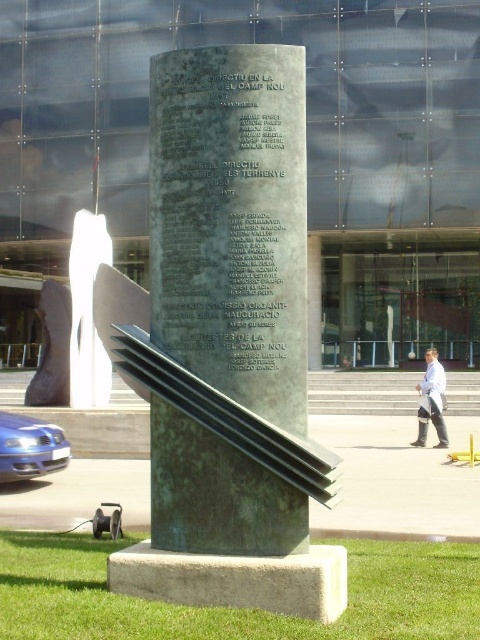
Question: Which point is farther from the camera taking this photo?

Choices:
 (A) (26, 456)
 (B) (441, 381)
 (C) (46, 307)

Answer: (B)

Question: Which of the following is the farthest from the observer?

Choices:
 (A) 443,432
 (B) 50,387
 (C) 11,470

Answer: (A)

Question: Does green patina stone monument at center appear on the right side of white lab coat at center?

Choices:
 (A) yes
 (B) no

Answer: (B)

Question: Does green patina stone monument at center appear on the left side of matte bronze statue at center?

Choices:
 (A) yes
 (B) no

Answer: (B)

Question: Based on their relative distances, which object is farther from the white lab coat at center?

Choices:
 (A) matte bronze statue at center
 (B) blue metallic car at lower left
 (C) green patina stone monument at center

Answer: (C)

Question: Does green patina stone monument at center have a smaller size compared to blue metallic car at lower left?

Choices:
 (A) yes
 (B) no

Answer: (B)